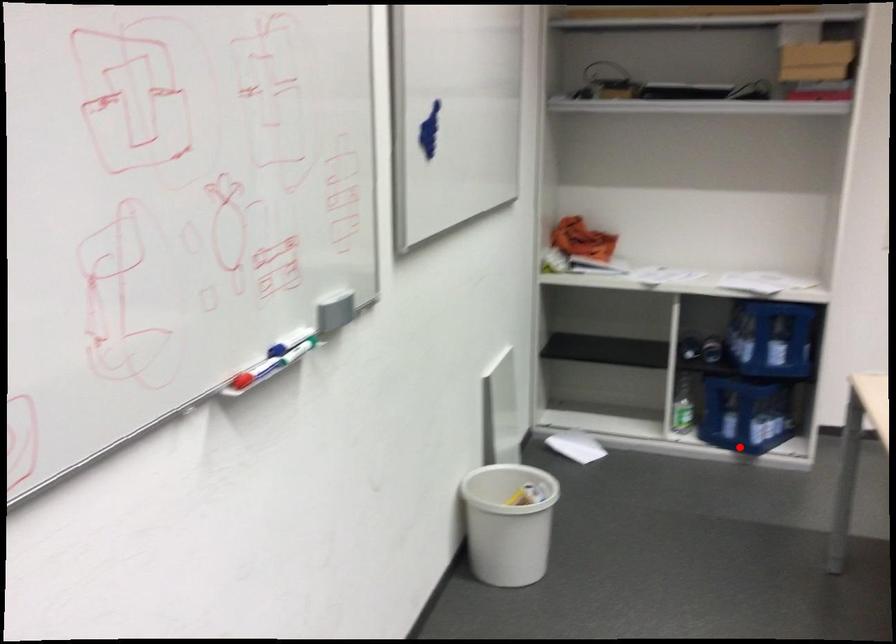
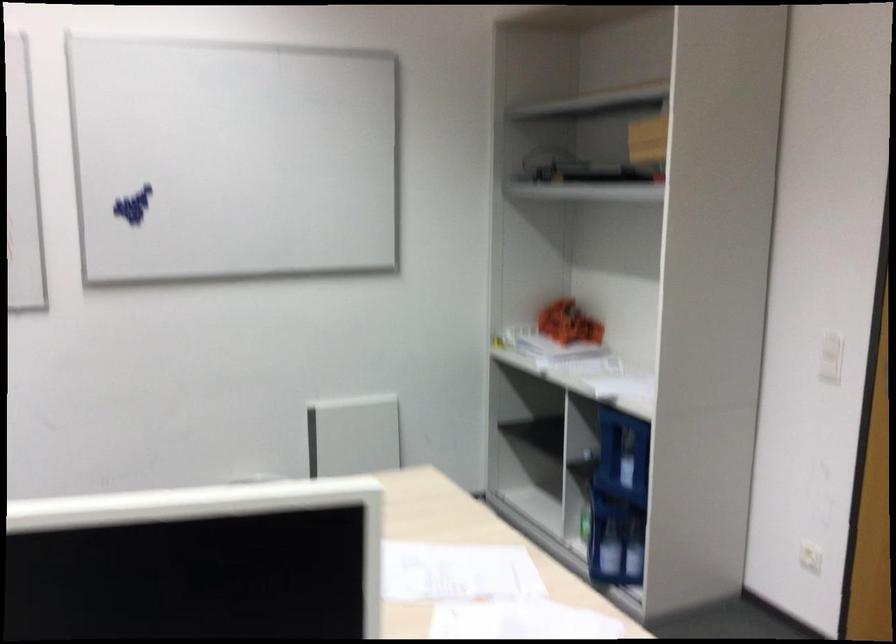
Question: I am providing you with two images of the same scene from different viewpoints. In image1, a red point is highlighted. Considering the same 3D point in image2, which of the following is correct?

Choices:
 (A) It is closer
 (B) It is farther

Answer: (A)